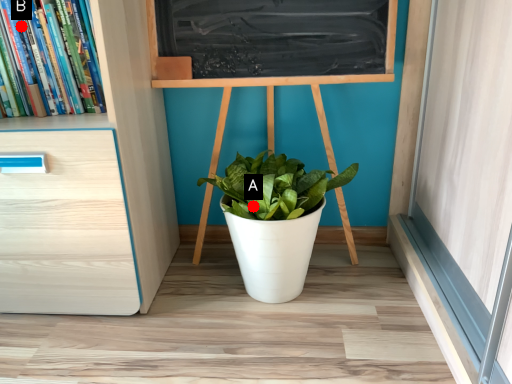
Question: Two points are circled on the image, labeled by A and B beside each circle. Which point appears closest to the camera in this image?

Choices:
 (A) A is closer
 (B) B is closer

Answer: (B)